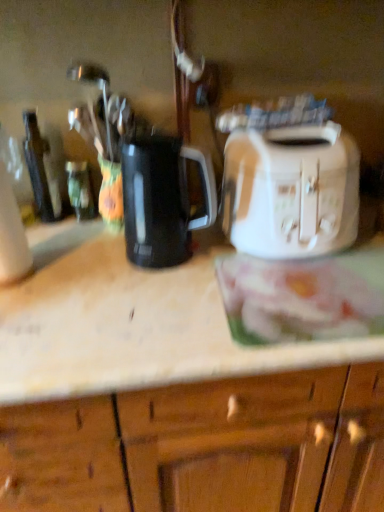
Question: Based on their sizes in the image, would you say white glossy bread at center is bigger or smaller than white plastic toaster at right?

Choices:
 (A) small
 (B) big

Answer: (A)

Question: Is white glossy bread at center to the left or to the right of white plastic toaster at right in the image?

Choices:
 (A) left
 (B) right

Answer: (B)

Question: Based on their relative distances, which object is farther from the green glass bottle at left, which is counted as the 2th bottle, starting from the left?

Choices:
 (A) white glossy bread at center
 (B) white plastic toaster at right
 (C) black plastic kettle at center
 (D) white glossy toaster at upper right
 (E) dark brown glass bottle at left, acting as the first bottle starting from the left

Answer: (A)

Question: Estimate the real-world distances between objects in this image. Which object is farther from the white glossy toaster at upper right?

Choices:
 (A) green glass bottle at left, which is counted as the 2th bottle, starting from the left
 (B) dark brown glass bottle at left, acting as the first bottle starting from the left
 (C) white glossy bread at center
 (D) white plastic toaster at right
 (E) black plastic kettle at center

Answer: (B)